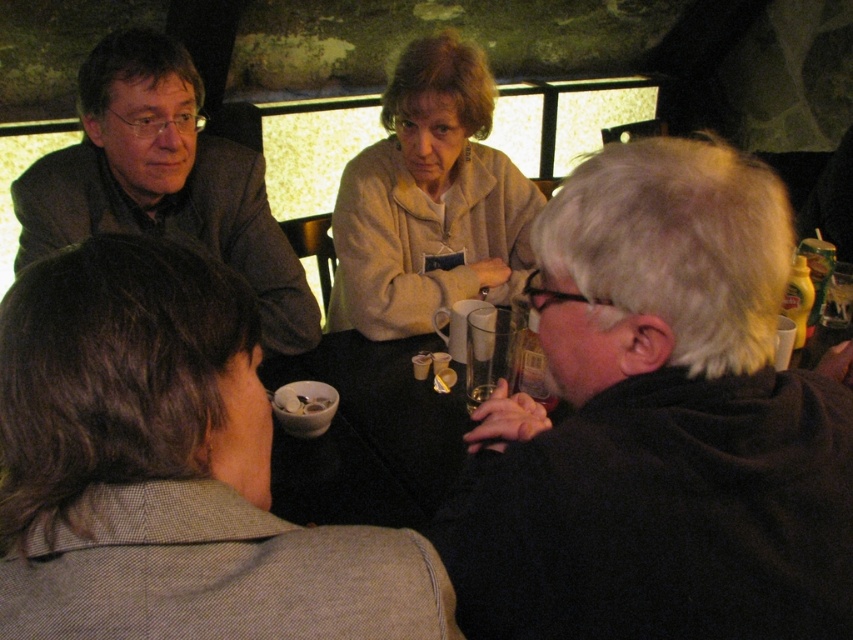
Between point (210, 180) and point (434, 276), which one is positioned in front?

Point (210, 180) is in front.

Does matte brown jacket at upper left have a lesser width compared to light beige jacket at center?

Incorrect, matte brown jacket at upper left's width is not less than light beige jacket at center's.

What are the coordinates of `matte brown jacket at upper left` in the screenshot? It's located at (163, 180).

Where is `matte brown jacket at upper left`? Image resolution: width=853 pixels, height=640 pixels. matte brown jacket at upper left is located at coordinates (163, 180).

Does light beige jacket at center have a lesser width compared to white matte bowl at center?

Incorrect, light beige jacket at center's width is not less than white matte bowl at center's.

Who is more distant from viewer, (432, 291) or (318, 408)?

Point (432, 291)

This screenshot has width=853, height=640. Find the location of `light beige jacket at center`. light beige jacket at center is located at coordinates (428, 200).

Find the location of a particular element. The image size is (853, 640). light beige jacket at center is located at coordinates (428, 200).

Between gray woolen jacket at lower left and matte brown jacket at upper left, which one appears on the left side from the viewer's perspective?

matte brown jacket at upper left is more to the left.

Is point (155, 365) in front of point (280, 316)?

That is True.

Find the location of a particular element. gray woolen jacket at lower left is located at coordinates (169, 468).